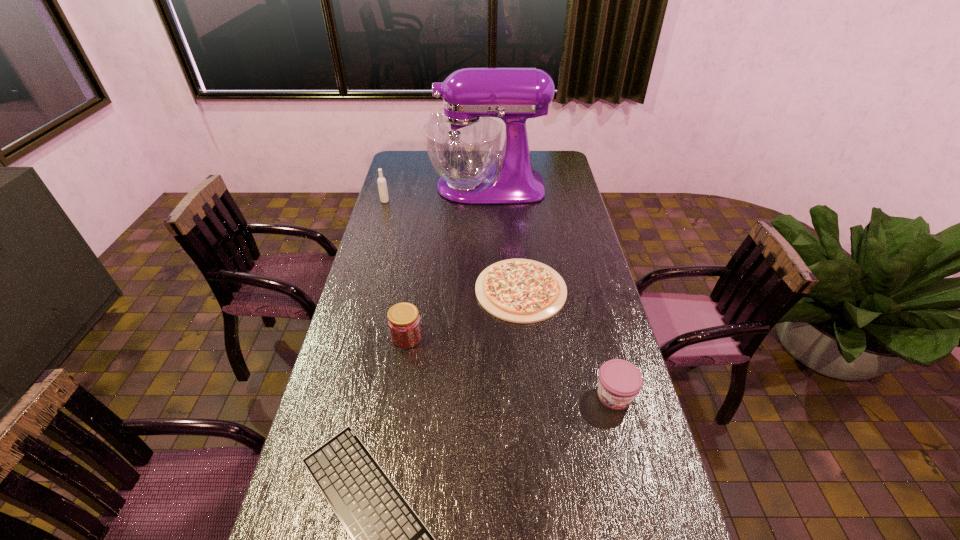
Locate an element on the screen. free space between the second tallest object and the third nearest object is located at coordinates (396, 269).

Select which object appears as the second closest to the tallest object. Please provide its 2D coordinates. Your answer should be formatted as a tuple, i.e. [(x, y)], where the tuple contains the x and y coordinates of a point satisfying the conditions above.

[(523, 291)]

What are the coordinates of `object that stands as the third closest to the second tallest object` in the screenshot? It's located at (404, 323).

Image resolution: width=960 pixels, height=540 pixels. Find the location of `vacant space that satisfies the following two spatial constraints: 1. at the bowl opening of the tallest object; 2. on the front side of the fifth shortest object`. vacant space that satisfies the following two spatial constraints: 1. at the bowl opening of the tallest object; 2. on the front side of the fifth shortest object is located at coordinates (487, 201).

At what (x,y) coordinates should I click in order to perform the action: click on vacant area that satisfies the following two spatial constraints: 1. at the bowl opening of the tallest object; 2. on the front side of the left jam. Please return your answer as a coordinate pair (x, y). This screenshot has width=960, height=540. Looking at the image, I should click on (490, 337).

The image size is (960, 540). I want to click on free region that satisfies the following two spatial constraints: 1. at the bowl opening of the fourth nearest object; 2. on the left side of the mixer, so click(x=489, y=290).